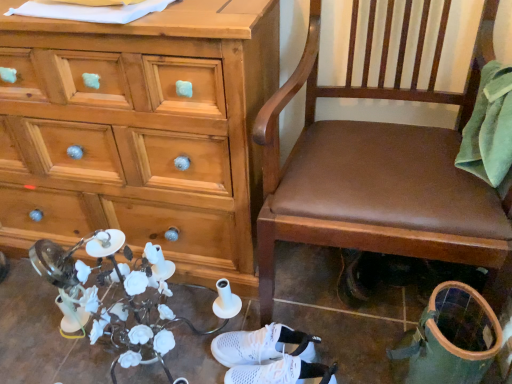
I want to click on white mesh sneakers at lower center, marked as the 1th footwear in a front-to-back arrangement, so click(x=282, y=372).

Where is `brown leather chair at center`? The height and width of the screenshot is (384, 512). brown leather chair at center is located at coordinates (378, 166).

Which object is wider, white mesh sneakers at lower center, the 2th footwear in the back-to-front sequence, or white mesh sneakers at center, arranged as the first footwear when viewed from the back?

With larger width is white mesh sneakers at center, arranged as the first footwear when viewed from the back.

Is there a large distance between white mesh sneakers at lower center, the 2th footwear in the back-to-front sequence, and white mesh sneakers at center, the second footwear positioned from the front?

Actually, white mesh sneakers at lower center, the 2th footwear in the back-to-front sequence, and white mesh sneakers at center, the second footwear positioned from the front, are a little close together.

Based on the photo, from a real-world perspective, is white mesh sneakers at lower center, marked as the 1th footwear in a front-to-back arrangement, located beneath white mesh sneakers at center, arranged as the first footwear when viewed from the back?

No.

Is point (437, 51) farther from camera compared to point (91, 61)?

That is True.

In the scene shown: How distant is brown leather chair at center from wooden chest of drawers at left?

brown leather chair at center and wooden chest of drawers at left are 14.54 inches apart.

Between brown leather chair at center and wooden chest of drawers at left, which one has larger width?

With larger width is brown leather chair at center.

Considering the sizes of objects brown leather chair at center and wooden chest of drawers at left in the image provided, who is smaller, brown leather chair at center or wooden chest of drawers at left?

brown leather chair at center is smaller.

Considering the relative sizes of white mesh sneakers at center, the second footwear positioned from the front, and wooden chest of drawers at left in the image provided, is white mesh sneakers at center, the second footwear positioned from the front, thinner than wooden chest of drawers at left?

Yes.

Based on the photo, could you tell me if white mesh sneakers at center, the second footwear positioned from the front, is facing wooden chest of drawers at left?

No, white mesh sneakers at center, the second footwear positioned from the front, is not facing towards wooden chest of drawers at left.

Can you see white mesh sneakers at center, arranged as the first footwear when viewed from the back, touching wooden chest of drawers at left?

white mesh sneakers at center, arranged as the first footwear when viewed from the back, is not next to wooden chest of drawers at left, and they're not touching.

Is point (93, 189) in front of point (275, 350)?

No, it is not.

In the image, is wooden chest of drawers at left on the left side or the right side of white mesh sneakers at center, the second footwear positioned from the front?

Based on their positions, wooden chest of drawers at left is located to the left of white mesh sneakers at center, the second footwear positioned from the front.

From the picture: Would you say wooden chest of drawers at left is inside or outside white mesh sneakers at center, arranged as the first footwear when viewed from the back?

The correct answer is: outside.

Who is more distant, wooden chest of drawers at left or white mesh sneakers at center, the second footwear positioned from the front?

white mesh sneakers at center, the second footwear positioned from the front.

Between white mesh sneakers at center, arranged as the first footwear when viewed from the back, and brown leather chair at center, which one is positioned in front?

Positioned in front is brown leather chair at center.

What's the angular difference between white mesh sneakers at center, the second footwear positioned from the front, and brown leather chair at center's facing directions?

The angular difference between white mesh sneakers at center, the second footwear positioned from the front, and brown leather chair at center is 77.4 degrees.

In terms of width, does white mesh sneakers at center, arranged as the first footwear when viewed from the back, look wider or thinner when compared to brown leather chair at center?

Considering their sizes, white mesh sneakers at center, arranged as the first footwear when viewed from the back, looks slimmer than brown leather chair at center.

Is point (290, 333) closer or farther from the camera than point (268, 283)?

Point (290, 333).

Would you say brown leather chair at center is part of white mesh sneakers at lower center, marked as the 1th footwear in a front-to-back arrangement,'s contents?

No, brown leather chair at center is not surrounded by white mesh sneakers at lower center, marked as the 1th footwear in a front-to-back arrangement.

Which object is positioned more to the right, white mesh sneakers at lower center, marked as the 1th footwear in a front-to-back arrangement, or brown leather chair at center?

brown leather chair at center.

Are white mesh sneakers at lower center, the 2th footwear in the back-to-front sequence, and brown leather chair at center located far from each other?

No, white mesh sneakers at lower center, the 2th footwear in the back-to-front sequence, is not far away from brown leather chair at center.

From a real-world perspective, who is located higher, white mesh sneakers at lower center, the 2th footwear in the back-to-front sequence, or brown leather chair at center?

brown leather chair at center is physically above.

Is brown leather chair at center not near white mesh sneakers at center, arranged as the first footwear when viewed from the back?

No, there isn't a large distance between brown leather chair at center and white mesh sneakers at center, arranged as the first footwear when viewed from the back.

Who is bigger, brown leather chair at center or white mesh sneakers at center, the second footwear positioned from the front?

With larger size is brown leather chair at center.

Considering the sizes of objects brown leather chair at center and white mesh sneakers at center, the second footwear positioned from the front, in the image provided, who is wider, brown leather chair at center or white mesh sneakers at center, the second footwear positioned from the front,?

Wider between the two is brown leather chair at center.

Is point (374, 205) behind point (292, 338)?

No.

Image resolution: width=512 pixels, height=384 pixels. I want to click on footwear located on the left of white mesh sneakers at lower center, marked as the 1th footwear in a front-to-back arrangement, so click(x=263, y=345).

This screenshot has height=384, width=512. In the image, there is a brown leather chair at center. What are the coordinates of `the chest of drawers below it (from a real-world perspective)` in the screenshot? It's located at tap(140, 131).

When comparing their distances from brown leather chair at center, does white mesh sneakers at center, arranged as the first footwear when viewed from the back, or wooden chest of drawers at left seem further?

white mesh sneakers at center, arranged as the first footwear when viewed from the back, is positioned further to the anchor brown leather chair at center.

When comparing their distances from wooden chest of drawers at left, does white mesh sneakers at lower center, the 2th footwear in the back-to-front sequence, or white mesh sneakers at center, the second footwear positioned from the front, seem closer?

white mesh sneakers at center, the second footwear positioned from the front, is closer to wooden chest of drawers at left.

From the image, which object appears to be farther from brown leather chair at center, white mesh sneakers at lower center, the 2th footwear in the back-to-front sequence, or wooden chest of drawers at left?

white mesh sneakers at lower center, the 2th footwear in the back-to-front sequence, lies further to brown leather chair at center than the other object.

Which object lies nearer to the anchor point brown leather chair at center, white mesh sneakers at lower center, marked as the 1th footwear in a front-to-back arrangement, or white mesh sneakers at center, arranged as the first footwear when viewed from the back?

white mesh sneakers at center, arranged as the first footwear when viewed from the back, is positioned closer to the anchor brown leather chair at center.

From the picture: Based on their spatial positions, is white mesh sneakers at lower center, the 2th footwear in the back-to-front sequence, or wooden chest of drawers at left closer to white mesh sneakers at center, arranged as the first footwear when viewed from the back?

Based on the image, white mesh sneakers at lower center, the 2th footwear in the back-to-front sequence, appears to be nearer to white mesh sneakers at center, arranged as the first footwear when viewed from the back.

Estimate the real-world distances between objects in this image. Which object is closer to brown leather chair at center, white mesh sneakers at center, arranged as the first footwear when viewed from the back, or white mesh sneakers at lower center, the 2th footwear in the back-to-front sequence?

white mesh sneakers at center, arranged as the first footwear when viewed from the back, is closer to brown leather chair at center.

Considering their positions, is wooden chest of drawers at left positioned closer to brown leather chair at center than white mesh sneakers at lower center, marked as the 1th footwear in a front-to-back arrangement?

wooden chest of drawers at left lies closer to brown leather chair at center than the other object.

When comparing their distances from brown leather chair at center, does wooden chest of drawers at left or white mesh sneakers at center, arranged as the first footwear when viewed from the back, seem closer?

Based on the image, wooden chest of drawers at left appears to be nearer to brown leather chair at center.

Find the location of a particular element. The width and height of the screenshot is (512, 384). footwear between wooden chest of drawers at left and white mesh sneakers at lower center, marked as the 1th footwear in a front-to-back arrangement, in the vertical direction is located at coordinates tap(263, 345).

I want to click on footwear between brown leather chair at center and white mesh sneakers at lower center, the 2th footwear in the back-to-front sequence, from top to bottom, so click(263, 345).